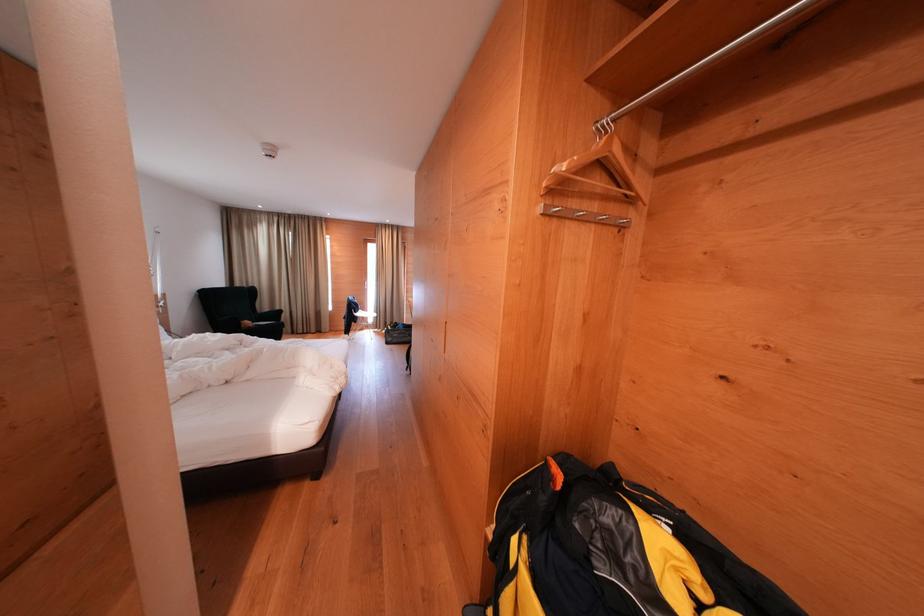
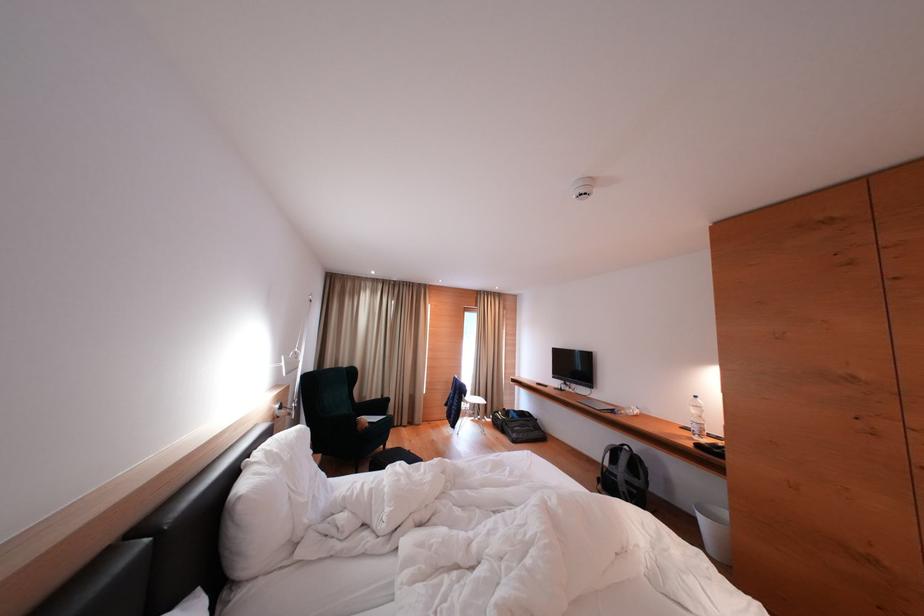
Find the pixel in the second image that matches (x=374, y=318) in the first image.

(477, 402)